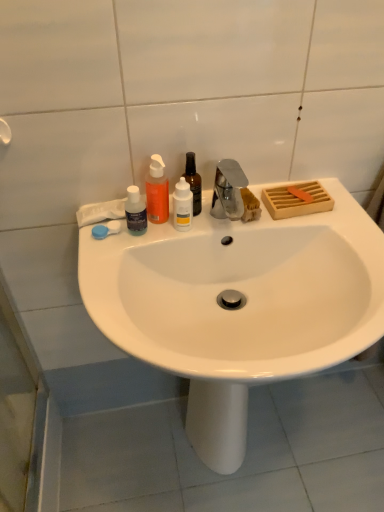
Question: Does blue plastic soap at left have a greater height compared to white matte bottle at center, which is counted as the second bottle, starting from the right?

Choices:
 (A) no
 (B) yes

Answer: (A)

Question: Is blue plastic soap at left surrounding white matte bottle at center, which is counted as the second bottle, starting from the right?

Choices:
 (A) yes
 (B) no

Answer: (B)

Question: From the image's perspective, is blue plastic soap at left located beneath white matte bottle at center, which is counted as the second bottle, starting from the right?

Choices:
 (A) no
 (B) yes

Answer: (B)

Question: Is blue plastic soap at left positioned behind white matte bottle at center, which is counted as the second bottle, starting from the right?

Choices:
 (A) no
 (B) yes

Answer: (B)

Question: Is blue plastic soap at left oriented away from white matte bottle at center, which is counted as the 3th bottle, starting from the left?

Choices:
 (A) no
 (B) yes

Answer: (A)

Question: Is transparent plastic bottle at center, the first bottle in the right-to-left sequence, wider or thinner than white glossy sink at center?

Choices:
 (A) thin
 (B) wide

Answer: (A)

Question: Considering the positions of point (190, 157) and point (342, 252), is point (190, 157) closer or farther from the camera than point (342, 252)?

Choices:
 (A) closer
 (B) farther

Answer: (A)

Question: Is transparent plastic bottle at center, arranged as the 4th bottle when viewed from the left, inside or outside of white glossy sink at center?

Choices:
 (A) inside
 (B) outside

Answer: (B)

Question: In the image, is transparent plastic bottle at center, arranged as the 4th bottle when viewed from the left, positioned in front of or behind white glossy sink at center?

Choices:
 (A) behind
 (B) front

Answer: (A)

Question: Is transparent plastic bottle at center, the first bottle in the right-to-left sequence, bigger or smaller than white matte bottle at center, which is counted as the second bottle, starting from the right?

Choices:
 (A) big
 (B) small

Answer: (A)

Question: From the image's perspective, is transparent plastic bottle at center, the first bottle in the right-to-left sequence, located above or below white matte bottle at center, which is counted as the 3th bottle, starting from the left?

Choices:
 (A) below
 (B) above

Answer: (B)

Question: Considering the positions of transparent plastic bottle at center, arranged as the 4th bottle when viewed from the left, and white matte bottle at center, which is counted as the 3th bottle, starting from the left, in the image, is transparent plastic bottle at center, arranged as the 4th bottle when viewed from the left, taller or shorter than white matte bottle at center, which is counted as the 3th bottle, starting from the left,?

Choices:
 (A) short
 (B) tall

Answer: (B)

Question: Considering the positions of transparent plastic bottle at center, arranged as the 4th bottle when viewed from the left, and white matte bottle at center, which is counted as the second bottle, starting from the right, in the image, is transparent plastic bottle at center, arranged as the 4th bottle when viewed from the left, wider or thinner than white matte bottle at center, which is counted as the second bottle, starting from the right,?

Choices:
 (A) wide
 (B) thin

Answer: (A)

Question: Considering their positions, is white matte bottle at center, which is counted as the second bottle, starting from the right, located in front of or behind transparent plastic bottle at center, arranged as the 4th bottle when viewed from the left?

Choices:
 (A) behind
 (B) front

Answer: (B)

Question: Is white matte bottle at center, which is counted as the 3th bottle, starting from the left, wider or thinner than transparent plastic bottle at center, arranged as the 4th bottle when viewed from the left?

Choices:
 (A) wide
 (B) thin

Answer: (B)